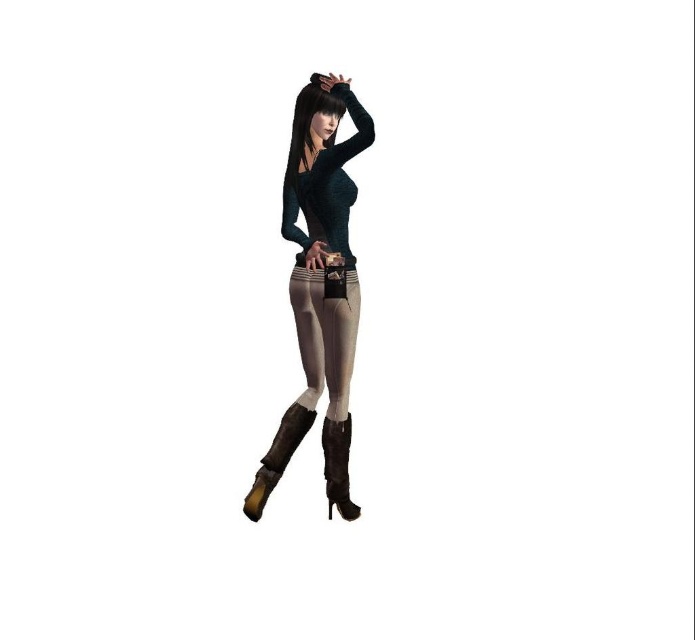
Question: Is satin black top at center below satin beige leggings at center?

Choices:
 (A) no
 (B) yes

Answer: (A)

Question: Does smooth black hair at upper center come behind leather high-heeled boot at lower center?

Choices:
 (A) no
 (B) yes

Answer: (A)

Question: Which point appears closest to the camera in this image?

Choices:
 (A) pyautogui.click(x=311, y=396)
 (B) pyautogui.click(x=277, y=444)
 (C) pyautogui.click(x=320, y=221)
 (D) pyautogui.click(x=343, y=504)

Answer: (C)

Question: Does satin beige leggings at center have a greater width compared to leather high-heeled boot at lower right?

Choices:
 (A) yes
 (B) no

Answer: (A)

Question: Which point is farther to the camera?

Choices:
 (A) (291, 433)
 (B) (357, 515)

Answer: (B)

Question: Which point appears farthest from the camera in this image?

Choices:
 (A) (275, 448)
 (B) (343, 452)
 (C) (304, 97)

Answer: (A)